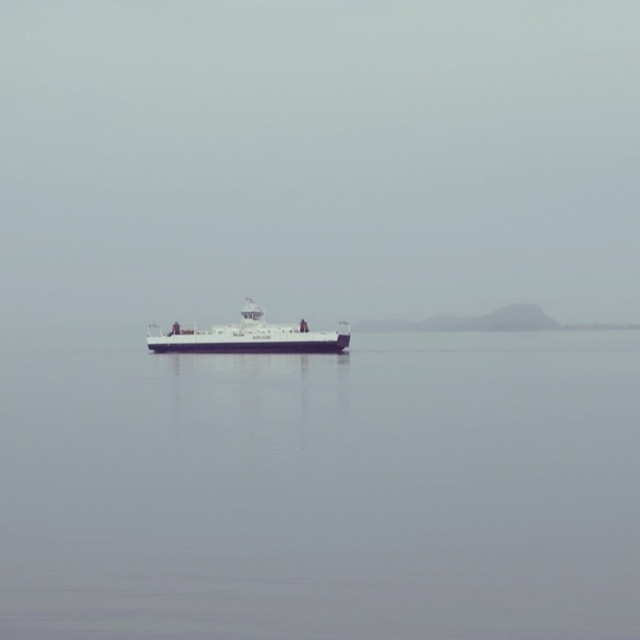
Question: Is smooth gray water at center to the left of white matte ship at center from the viewer's perspective?

Choices:
 (A) yes
 (B) no

Answer: (B)

Question: Is smooth gray water at center to the right of white matte ship at center from the viewer's perspective?

Choices:
 (A) yes
 (B) no

Answer: (A)

Question: Can you confirm if smooth gray water at center is wider than white matte ship at center?

Choices:
 (A) no
 (B) yes

Answer: (B)

Question: Which of the following is the farthest from the observer?

Choices:
 (A) (346, 547)
 (B) (282, 326)

Answer: (B)

Question: Which point is farther to the camera?

Choices:
 (A) (166, 348)
 (B) (97, 540)

Answer: (A)

Question: Among these objects, which one is nearest to the camera?

Choices:
 (A) smooth gray water at center
 (B) white matte ship at center

Answer: (A)